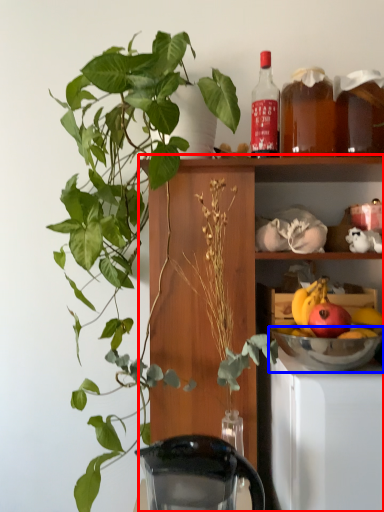
Question: Among these objects, which one is farthest to the camera, cabinetry (highlighted by a red box) or mixing bowl (highlighted by a blue box)?

Choices:
 (A) cabinetry
 (B) mixing bowl

Answer: (B)